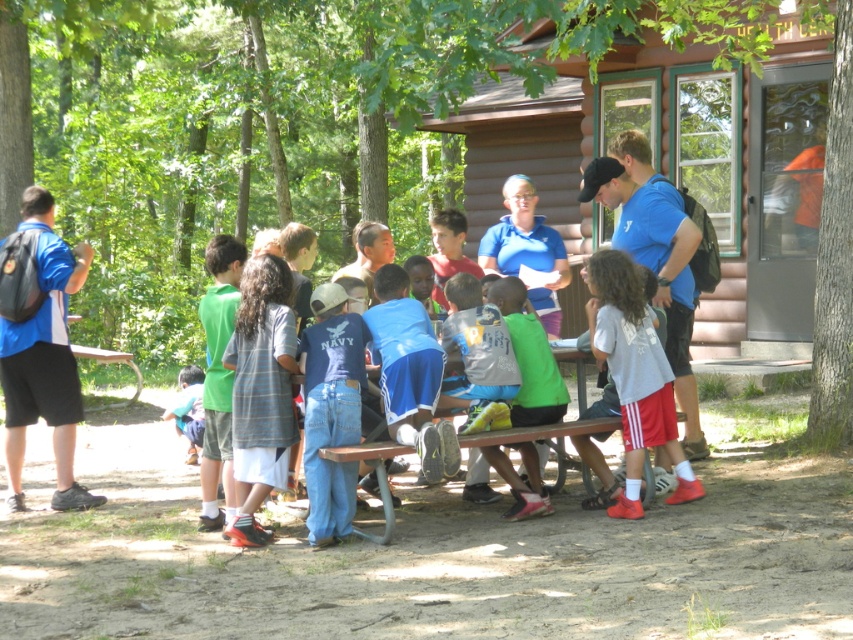
Question: Can you confirm if striped cotton shirt at center is bigger than white cotton shirt at center?

Choices:
 (A) no
 (B) yes

Answer: (A)

Question: Which point appears closest to the camera in this image?

Choices:
 (A) (427, 435)
 (B) (587, 428)
 (C) (263, 352)

Answer: (A)

Question: Is brown wooden log cabin at center wider than white cotton shirt at center?

Choices:
 (A) no
 (B) yes

Answer: (B)

Question: In this image, where is white cotton shirt at center located relative to brown wooden picnic table at center?

Choices:
 (A) left
 (B) right

Answer: (B)

Question: Which point appears farthest from the camera in this image?

Choices:
 (A) (320, 515)
 (B) (611, 360)

Answer: (B)

Question: Which object is positioned farthest from the white cotton shirt at center?

Choices:
 (A) striped cotton shirt at center
 (B) brown wooden picnic table at center

Answer: (A)